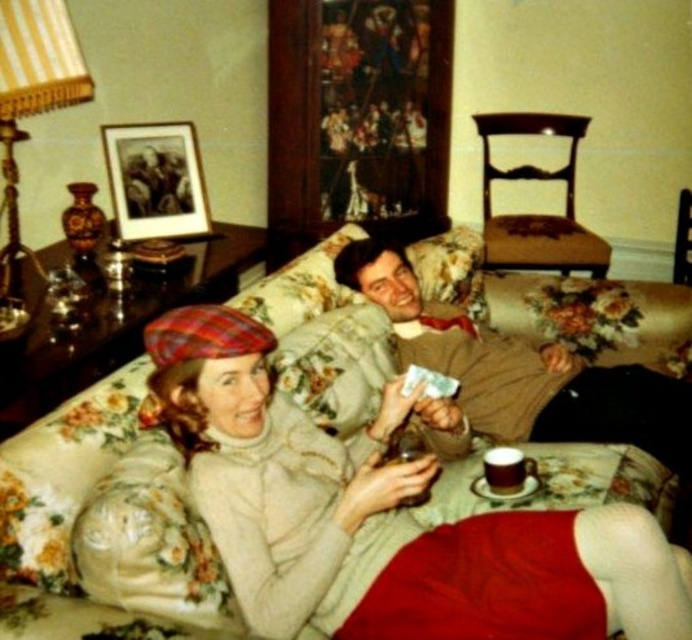
Question: Among these points, which one is farthest from the camera?

Choices:
 (A) (143, 173)
 (B) (464, 404)
 (C) (673, 275)

Answer: (C)

Question: In this image, where is brown fabric armchair at upper right located relative to black matte picture frame at upper left?

Choices:
 (A) right
 (B) left

Answer: (A)

Question: Which is farther from the floral fabric armchair at center?

Choices:
 (A) matte ceramic cup at lower center
 (B) brown fabric armchair at upper right

Answer: (A)

Question: Is floral fabric couch at center to the left of black matte picture frame at upper left from the viewer's perspective?

Choices:
 (A) yes
 (B) no

Answer: (B)

Question: Is light brown wool sweater at center bigger than brown fabric armchair at upper right?

Choices:
 (A) yes
 (B) no

Answer: (A)

Question: Which object appears closest to the camera in this image?

Choices:
 (A) black matte picture frame at upper left
 (B) floral fabric armchair at center

Answer: (A)